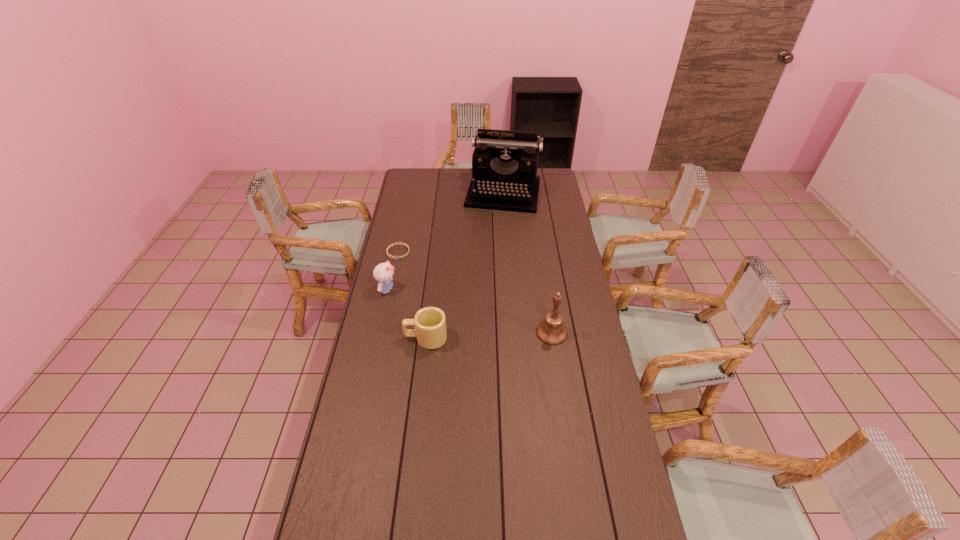
What are the coordinates of `free space that is in between the bell and the second shortest object` in the screenshot? It's located at (489, 335).

At what (x,y) coordinates should I click in order to perform the action: click on object that is the closest one to the kitten. Please return your answer as a coordinate pair (x, y). This screenshot has height=540, width=960. Looking at the image, I should click on (406, 254).

Select which object appears as the fourth closest to the farthest object. Please provide its 2D coordinates. Your answer should be formatted as a tuple, i.e. [(x, y)], where the tuple contains the x and y coordinates of a point satisfying the conditions above.

[(430, 331)]

Where is `vacant area that satisfies the following two spatial constraints: 1. on the front side of the third farthest object; 2. with the handle on the side of the fourth tallest object`? This screenshot has height=540, width=960. vacant area that satisfies the following two spatial constraints: 1. on the front side of the third farthest object; 2. with the handle on the side of the fourth tallest object is located at coordinates (377, 338).

You are a GUI agent. You are given a task and a screenshot of the screen. Output one action in this format:
    pyautogui.click(x=<x>, y=<y>)
    Task: Click on the free space that satisfies the following two spatial constraints: 1. on the back side of the bracelet; 2. on the left side of the typewriter
    The width and height of the screenshot is (960, 540).
    Given the screenshot: What is the action you would take?
    pyautogui.click(x=411, y=193)